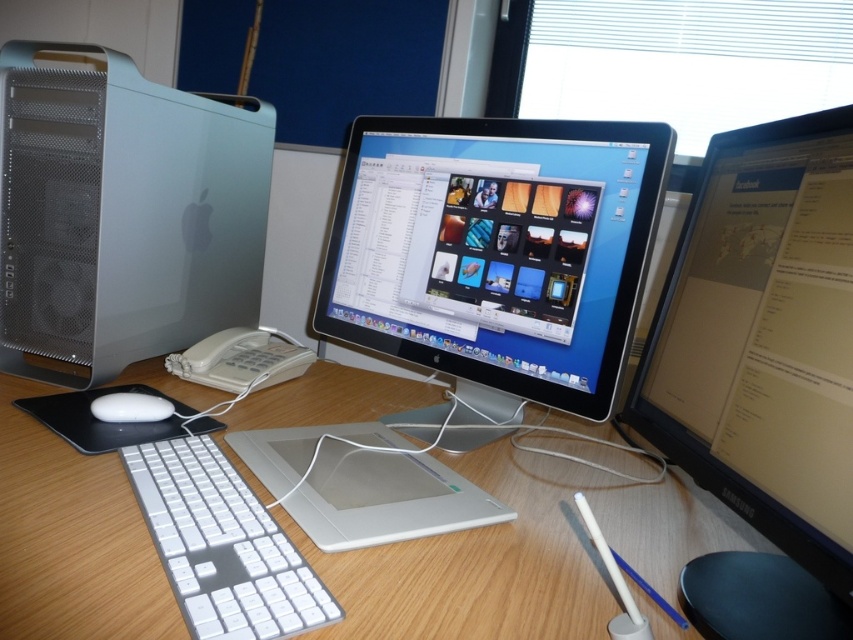
Question: Which object is closer to the camera taking this photo?

Choices:
 (A) satin black monitor at center
 (B) white matte mouse at lower left
 (C) wooden desk at center
 (D) silver/plastic laptop at center

Answer: (C)

Question: Is white plastic keyboard at center above silver/plastic laptop at center?

Choices:
 (A) yes
 (B) no

Answer: (B)

Question: Can you confirm if wooden desk at center is wider than satin black monitor at center?

Choices:
 (A) yes
 (B) no

Answer: (A)

Question: Can you confirm if matte black monitor at center is wider than satin black monitor at center?

Choices:
 (A) yes
 (B) no

Answer: (B)

Question: Which of these objects is positioned farthest from the satin silver computer at left?

Choices:
 (A) matte black monitor at center
 (B) silver/plastic laptop at center
 (C) white matte mouse at lower left

Answer: (A)

Question: Which point appears closest to the camera in this image?

Choices:
 (A) (248, 547)
 (B) (154, 416)
 (C) (381, 440)

Answer: (A)